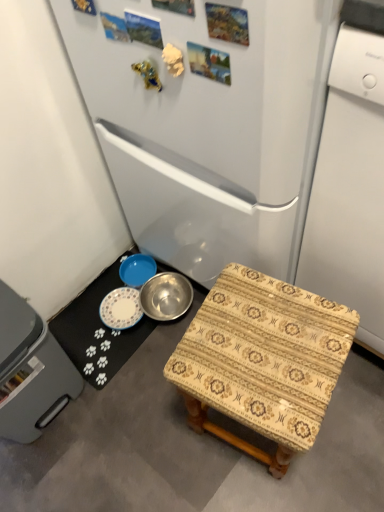
Image resolution: width=384 pixels, height=512 pixels. Describe the element at coordinates (350, 188) in the screenshot. I see `white glossy dishwasher at right` at that location.

Locate an element on the screen. The width and height of the screenshot is (384, 512). white glossy dishwasher at right is located at coordinates (350, 188).

Identify the location of metallic silver bowl at lower left. Image resolution: width=384 pixels, height=512 pixels. (192, 448).

Locate an element on the screen. patterned fabric stool at lower right is located at coordinates (263, 361).

From a real-world perspective, is metallic silver bowl at lower center positioned above or below white glossy refrigerator at center?

From a real-world perspective, metallic silver bowl at lower center is physically below white glossy refrigerator at center.

Who is bigger, metallic silver bowl at lower center or white glossy refrigerator at center?

With larger size is white glossy refrigerator at center.

Consider the image. From the image's perspective, which one is positioned higher, metallic silver bowl at lower center or white glossy refrigerator at center?

white glossy refrigerator at center.

You are a GUI agent. You are given a task and a screenshot of the screen. Output one action in this format:
    pyautogui.click(x=<x>, y=<y>)
    Task: Click on the refrigerator above the metallic silver bowl at lower center (from a real-world perspective)
    The height and width of the screenshot is (512, 384).
    Given the screenshot: What is the action you would take?
    pyautogui.click(x=208, y=122)

Measure the distance between metallic silver bowl at lower center and metallic silver bowl at lower left.

metallic silver bowl at lower center is 9.68 inches away from metallic silver bowl at lower left.

How many degrees apart are the facing directions of metallic silver bowl at lower center and metallic silver bowl at lower left?

There is a 178-degree angle between the facing directions of metallic silver bowl at lower center and metallic silver bowl at lower left.

I want to click on concrete that appears on the right of metallic silver bowl at lower center, so click(x=192, y=448).

Based on the photo, is metallic silver bowl at lower center in contact with metallic silver bowl at lower left?

They are not placed beside each other.

From the picture: Can you confirm if gray plastic dishwasher at lower left is taller than metallic silver bowl at lower center?

Yes, gray plastic dishwasher at lower left is taller than metallic silver bowl at lower center.

Is gray plastic dishwasher at lower left situated inside metallic silver bowl at lower center or outside?

gray plastic dishwasher at lower left is not enclosed by metallic silver bowl at lower center.

Considering the sizes of objects gray plastic dishwasher at lower left and metallic silver bowl at lower center in the image provided, who is smaller, gray plastic dishwasher at lower left or metallic silver bowl at lower center?

metallic silver bowl at lower center.

Who is shorter, patterned fabric stool at lower right or white glossy dishwasher at right?

With less height is patterned fabric stool at lower right.

Is white glossy dishwasher at right a part of patterned fabric stool at lower right?

Definitely not — white glossy dishwasher at right is not inside patterned fabric stool at lower right.

Is the surface of patterned fabric stool at lower right in direct contact with white glossy dishwasher at right?

There is a gap between patterned fabric stool at lower right and white glossy dishwasher at right.

The image size is (384, 512). What are the coordinates of `concrete lying below the white glossy dishwasher at right (from the image's perspective)` in the screenshot? It's located at (192, 448).

Does white glossy dishwasher at right have a greater width compared to metallic silver bowl at lower left?

Incorrect, the width of white glossy dishwasher at right does not surpass that of metallic silver bowl at lower left.

Considering the relative positions of white glossy dishwasher at right and metallic silver bowl at lower left in the image provided, is white glossy dishwasher at right behind metallic silver bowl at lower left?

No, white glossy dishwasher at right is closer to the viewer.

Are metallic silver bowl at lower left and white glossy refrigerator at center located far from each other?

No, metallic silver bowl at lower left is in close proximity to white glossy refrigerator at center.

From a real-world perspective, is metallic silver bowl at lower left physically below white glossy refrigerator at center?

Yes, from a real-world perspective, metallic silver bowl at lower left is under white glossy refrigerator at center.

Which is nearer, (334, 482) or (309, 6)?

The point (309, 6) is closer to the camera.

Is the depth of metallic silver bowl at lower left greater than that of gray plastic dishwasher at lower left?

No.

Is point (227, 493) closer or farther from the camera than point (32, 417)?

Point (227, 493).

At what (x,y) coordinates should I click in order to perform the action: click on concrete below the gray plastic dishwasher at lower left (from a real-world perspective). Please return your answer as a coordinate pair (x, y). This screenshot has height=512, width=384. Looking at the image, I should click on (192, 448).

Can you confirm if metallic silver bowl at lower left is thinner than gray plastic dishwasher at lower left?

No.

Identify the location of refrigerator on the right of metallic silver bowl at lower center. (208, 122).

Locate an element on the screen. table located behind the metallic silver bowl at lower left is located at coordinates (98, 331).

When comparing their distances from patterned fabric stool at lower right, does metallic silver bowl at lower center or gray plastic dishwasher at lower left seem further?

metallic silver bowl at lower center.

Consider the image. From the image, which object appears to be nearer to metallic silver bowl at lower left, metallic silver bowl at lower center or patterned fabric stool at lower right?

Based on the image, metallic silver bowl at lower center appears to be nearer to metallic silver bowl at lower left.

When comparing their distances from metallic silver bowl at lower left, does gray plastic dishwasher at lower left or white glossy refrigerator at center seem closer?

Among the two, gray plastic dishwasher at lower left is located nearer to metallic silver bowl at lower left.

From the image, which object appears to be nearer to metallic silver bowl at lower left, white glossy refrigerator at center or gray plastic dishwasher at lower left?

Based on the image, gray plastic dishwasher at lower left appears to be nearer to metallic silver bowl at lower left.

Based on their spatial positions, is metallic silver bowl at lower left or white glossy dishwasher at right closer to patterned fabric stool at lower right?

Answer: white glossy dishwasher at right is positioned closer to the anchor patterned fabric stool at lower right.

From the picture: Looking at the image, which one is located further to metallic silver bowl at lower center, gray plastic dishwasher at lower left or patterned fabric stool at lower right?

patterned fabric stool at lower right is further to metallic silver bowl at lower center.

Based on their spatial positions, is metallic silver bowl at lower center or patterned fabric stool at lower right further from gray plastic dishwasher at lower left?

Among the two, patterned fabric stool at lower right is located further to gray plastic dishwasher at lower left.

Based on their spatial positions, is gray plastic dishwasher at lower left or white glossy refrigerator at center closer to metallic silver bowl at lower center?

The object closer to metallic silver bowl at lower center is gray plastic dishwasher at lower left.

Locate an element on the screen. dish washer between metallic silver bowl at lower left and metallic silver bowl at lower center along the z-axis is located at coordinates (30, 371).

The image size is (384, 512). I want to click on appliance between white glossy refrigerator at center and metallic silver bowl at lower left from top to bottom, so click(350, 188).

At what (x,y) coordinates should I click in order to perform the action: click on furniture located between white glossy dishwasher at right and metallic silver bowl at lower center in the depth direction. Please return your answer as a coordinate pair (x, y). This screenshot has width=384, height=512. Looking at the image, I should click on (263, 361).

I want to click on furniture between gray plastic dishwasher at lower left and white glossy dishwasher at right, so tap(263, 361).